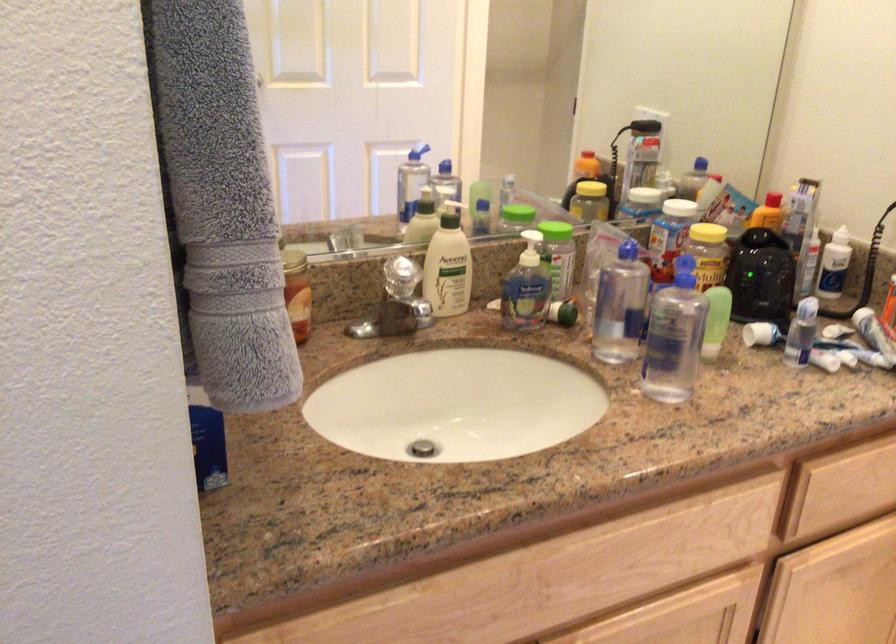
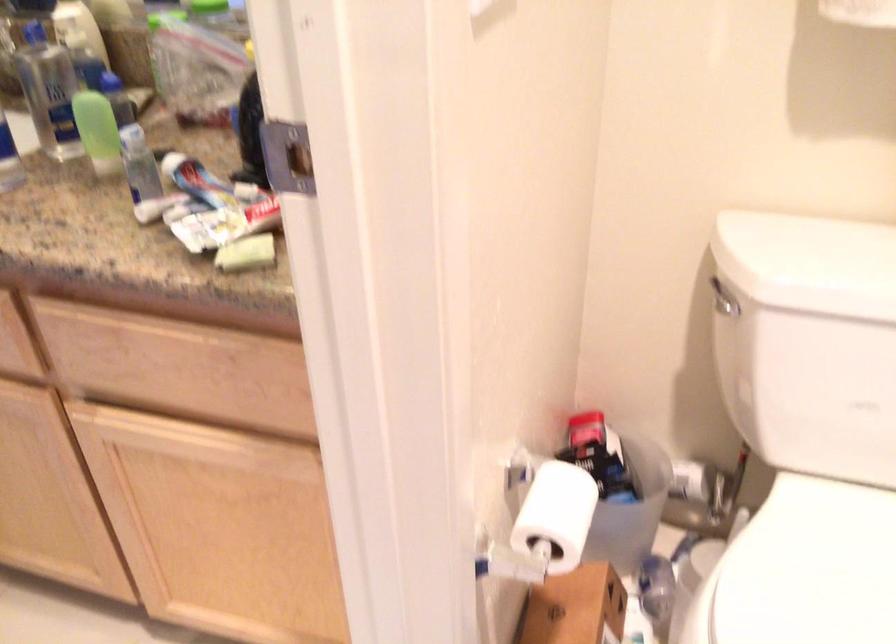
The point at (x=777, y=341) is marked in the first image. Where is the corresponding point in the second image?

(197, 182)